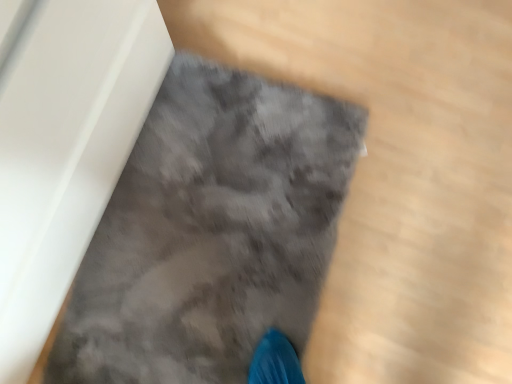
Question: Should I look upward or downward to see gray fluffy rug at lower left?

Choices:
 (A) down
 (B) up

Answer: (A)